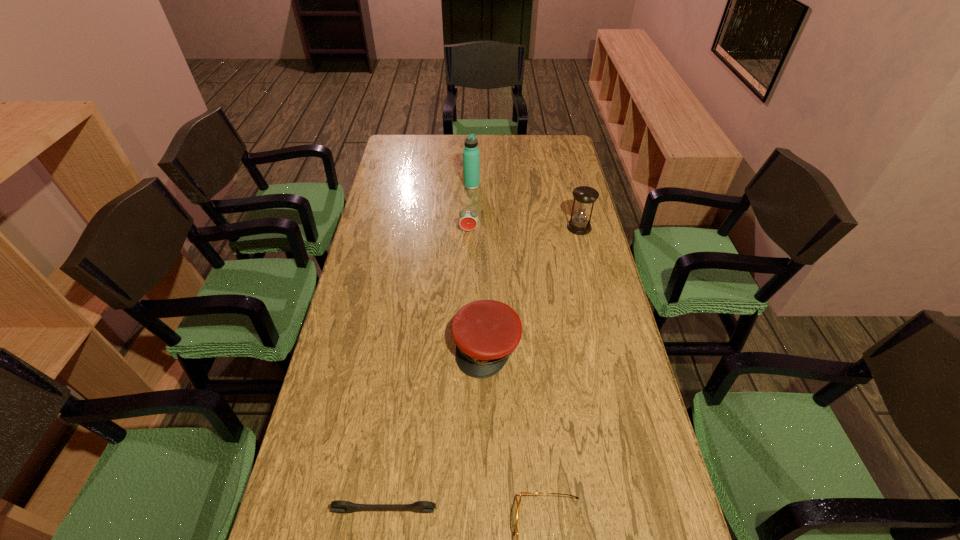
The width and height of the screenshot is (960, 540). I want to click on free space between the thermos bottle and the second tallest object, so click(x=525, y=206).

The width and height of the screenshot is (960, 540). Find the location of `free space between the tallest object and the rightmost object`. free space between the tallest object and the rightmost object is located at coordinates click(x=525, y=206).

I want to click on object identified as the closest to the thermos bottle, so click(468, 220).

Identify which object is the second nearest to the wrench. Please provide its 2D coordinates. Your answer should be formatted as a tuple, i.e. [(x, y)], where the tuple contains the x and y coordinates of a point satisfying the conditions above.

[(486, 332)]